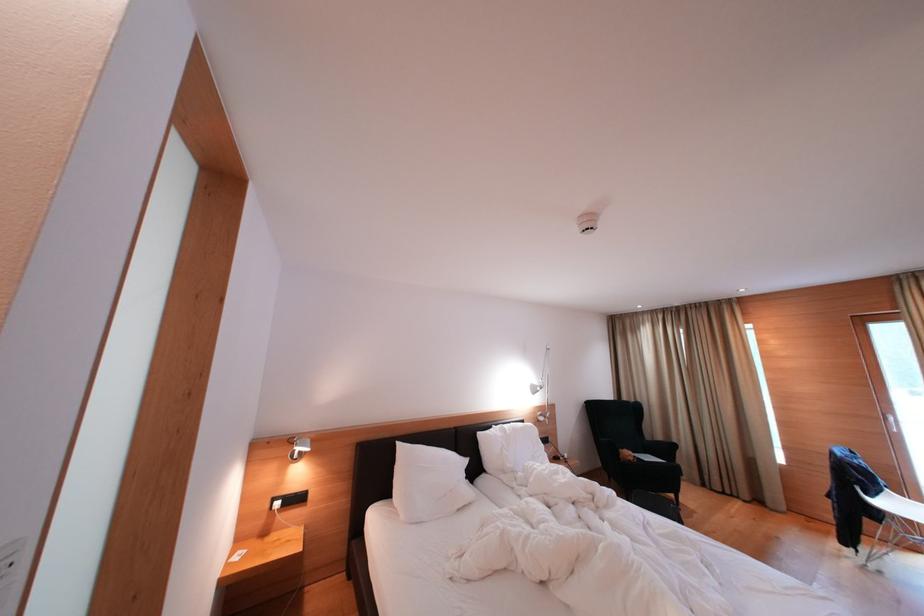
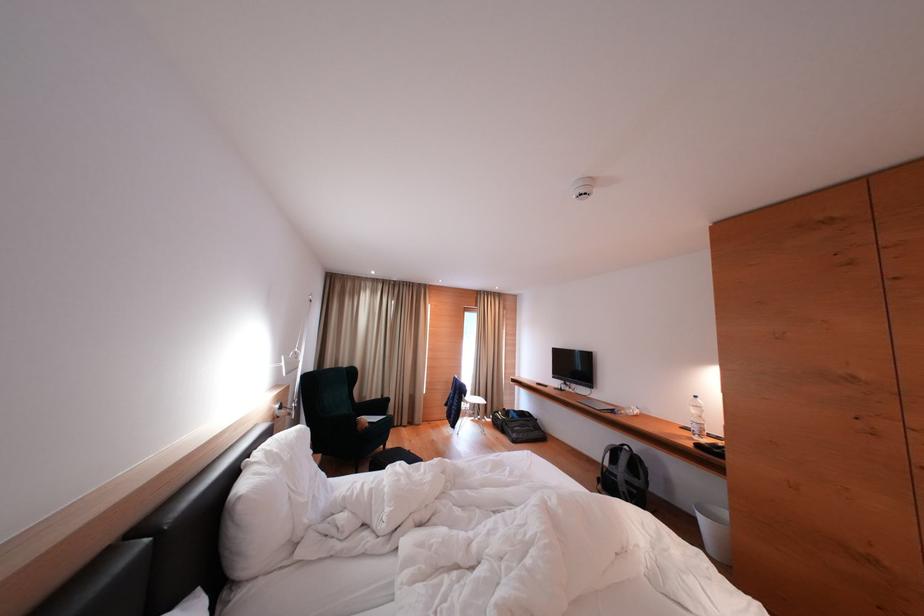
The point at [625,456] is marked in the first image. Where is the corresponding point in the second image?

(362, 428)